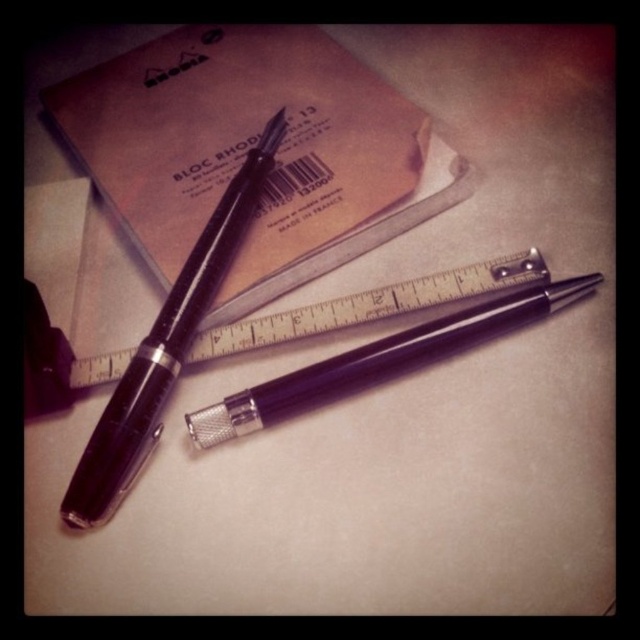
Question: Which of the following is the farthest from the observer?

Choices:
 (A) (524, 308)
 (B) (147, 412)

Answer: (A)

Question: Does matte black pen at upper left appear under metallic silver ruler at center?

Choices:
 (A) no
 (B) yes

Answer: (A)

Question: Estimate the real-world distances between objects in this image. Which object is closer to the metallic silver ruler at center?

Choices:
 (A) matte black pen at upper left
 (B) matte black fountain pen at center

Answer: (B)

Question: Which is nearer to the matte black pen at upper left?

Choices:
 (A) matte black fountain pen at center
 (B) metallic silver ruler at center

Answer: (B)

Question: Can you confirm if matte black pen at upper left is positioned above metallic silver ruler at center?

Choices:
 (A) no
 (B) yes

Answer: (B)

Question: Can you confirm if matte black pen at upper left is positioned below matte black fountain pen at center?

Choices:
 (A) yes
 (B) no

Answer: (B)